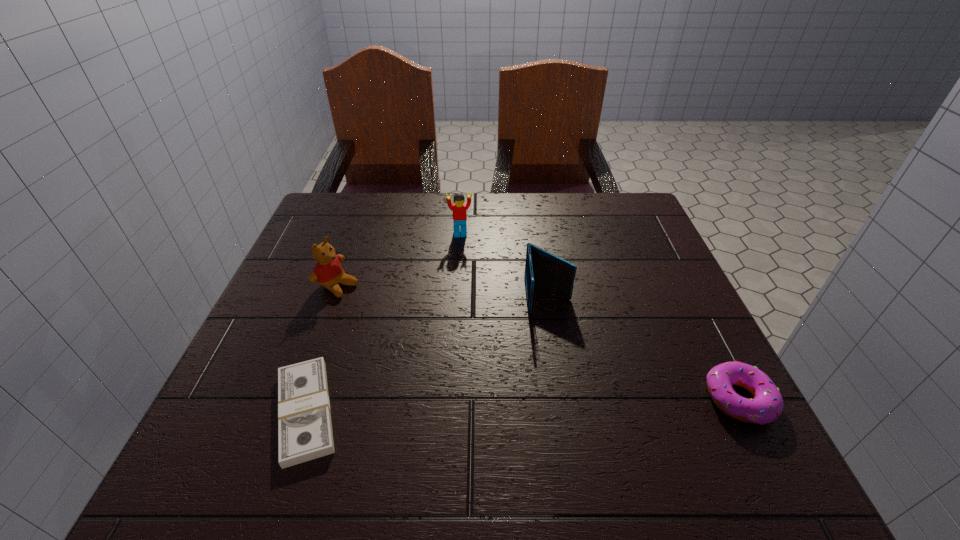
In order to click on dollar that is at the near edge in this screenshot , I will do `click(305, 433)`.

At what (x,y) coordinates should I click in order to perform the action: click on doughnut present at the near edge. Please return your answer as a coordinate pair (x, y). This screenshot has width=960, height=540. Looking at the image, I should click on (766, 406).

What are the coordinates of `dollar present at the left edge` in the screenshot? It's located at (305, 433).

What are the coordinates of `teddy bear at the left edge` in the screenshot? It's located at [328, 272].

Locate an element on the screen. This screenshot has height=540, width=960. object positioned at the right edge is located at coordinates (766, 406).

Identify the location of object present at the near left corner. This screenshot has height=540, width=960. (305, 433).

The width and height of the screenshot is (960, 540). Find the location of `object located in the near right corner section of the desktop`. object located in the near right corner section of the desktop is located at coordinates (766, 406).

Locate an element on the screen. free space at the far edge of the desktop is located at coordinates (434, 234).

You are a GUI agent. You are given a task and a screenshot of the screen. Output one action in this format:
    pyautogui.click(x=<x>, y=<y>)
    Task: Click on the free space at the left edge of the desktop
    The height and width of the screenshot is (540, 960).
    Given the screenshot: What is the action you would take?
    (300, 286)

The height and width of the screenshot is (540, 960). What are the coordinates of `vacant space at the right edge of the desktop` in the screenshot? It's located at (657, 285).